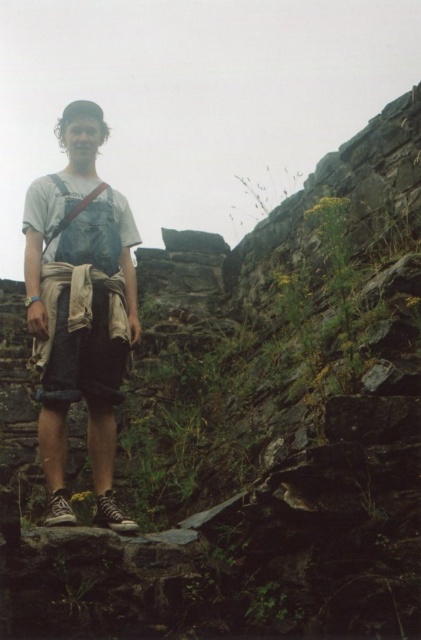
Where is `denim shorts at center`? This screenshot has height=640, width=421. denim shorts at center is located at coordinates (82, 333).

Does denim shorts at center have a larger size compared to denim suspenders at center?

Yes, denim shorts at center is bigger than denim suspenders at center.

Which is behind, point (80, 314) or point (66, 189)?

The point (66, 189) is behind.

I want to click on denim shorts at center, so click(x=82, y=333).

Does denim overalls at center have a greater width compared to denim suspenders at center?

Yes, denim overalls at center is wider than denim suspenders at center.

Which is above, denim overalls at center or denim suspenders at center?

denim suspenders at center

Locate an element on the screen. Image resolution: width=421 pixels, height=640 pixels. denim overalls at center is located at coordinates (80, 305).

At what (x,y) coordinates should I click in order to perform the action: click on denim overalls at center. Please return your answer as a coordinate pair (x, y). The width and height of the screenshot is (421, 640). Looking at the image, I should click on (80, 305).

Looking at this image, does denim overalls at center appear over denim shorts at center?

Yes, denim overalls at center is above denim shorts at center.

Who is more distant from viewer, (x=88, y=148) or (x=74, y=321)?

The point (x=88, y=148) is behind.

At what (x,y) coordinates should I click in order to perform the action: click on denim overalls at center. Please return your answer as a coordinate pair (x, y). This screenshot has width=421, height=640. Looking at the image, I should click on (80, 305).